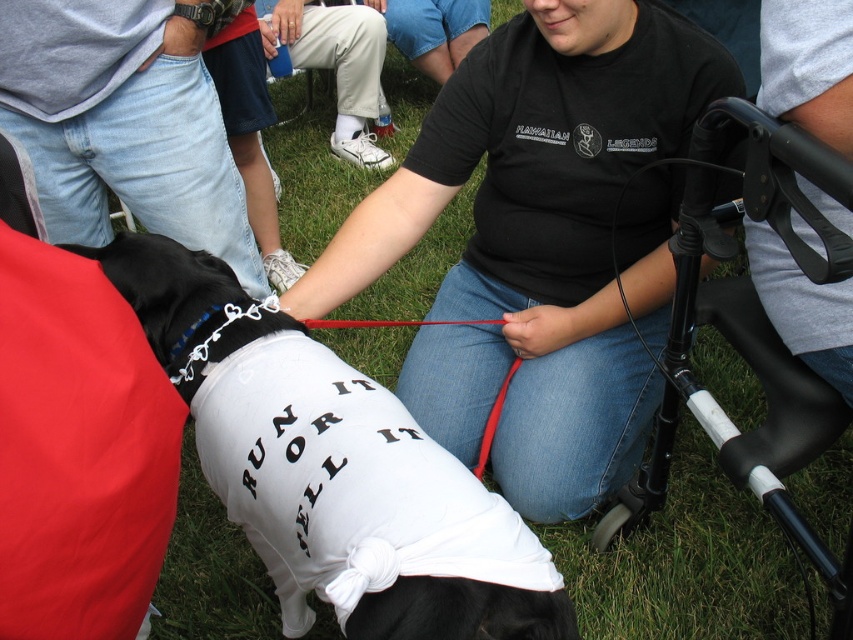
Is point (57, 72) closer to viewer compared to point (334, 42)?

That is True.

Does blue jeans at left have a greater width compared to white fabric shoe at lower center?

In fact, blue jeans at left might be narrower than white fabric shoe at lower center.

Is point (97, 234) positioned after point (332, 44)?

No, it is not.

The width and height of the screenshot is (853, 640). Identify the location of blue jeans at left. (123, 124).

Who is taller, white fabric shirt at center or white fabric shoe at lower center?

white fabric shoe at lower center is taller.

Does white fabric shirt at center appear on the left side of white fabric shoe at lower center?

Incorrect, white fabric shirt at center is not on the left side of white fabric shoe at lower center.

Where is `white fabric shirt at center`? This screenshot has height=640, width=853. white fabric shirt at center is located at coordinates (331, 467).

Can you confirm if black matte shirt at center is smaller than white fabric shirt at center?

Incorrect, black matte shirt at center is not smaller in size than white fabric shirt at center.

In the scene shown: Who is more distant from viewer, (500,170) or (206,381)?

Point (500,170)

This screenshot has width=853, height=640. In order to click on black matte shirt at center in this screenshot , I will do `click(535, 241)`.